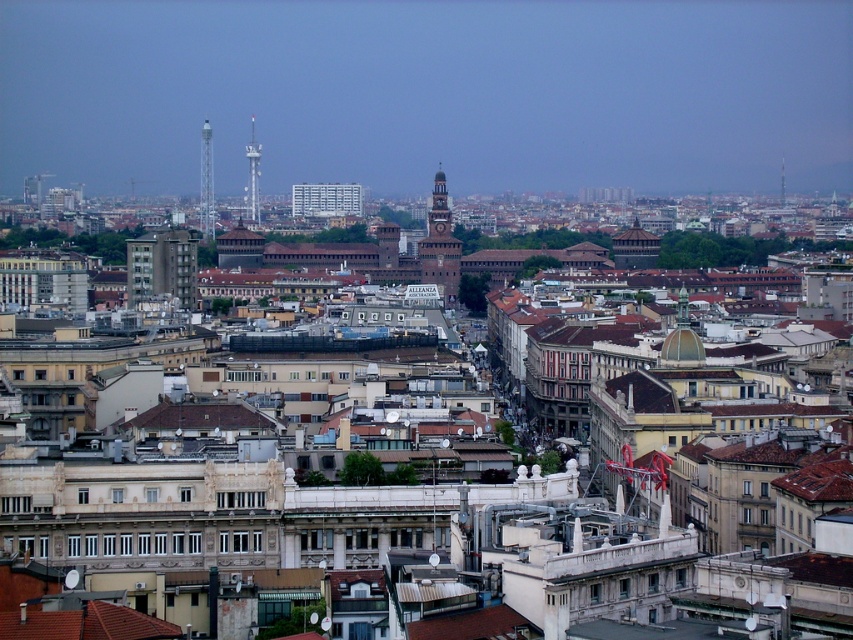
Question: Among these objects, which one is nearest to the camera?

Choices:
 (A) metallic tower at left
 (B) metallic silver tower at upper left
 (C) brick tower at center

Answer: (C)

Question: Which object is farther from the camera taking this photo?

Choices:
 (A) metallic tower at left
 (B) metallic silver tower at upper left

Answer: (A)

Question: Is brick tower at center below metallic silver tower at upper left?

Choices:
 (A) no
 (B) yes

Answer: (B)

Question: Among these objects, which one is farthest from the camera?

Choices:
 (A) brick tower at center
 (B) metallic silver tower at upper left

Answer: (B)

Question: Is brick tower at center wider than metallic tower at left?

Choices:
 (A) yes
 (B) no

Answer: (A)

Question: Can you confirm if brick tower at center is positioned above metallic silver tower at upper left?

Choices:
 (A) yes
 (B) no

Answer: (B)